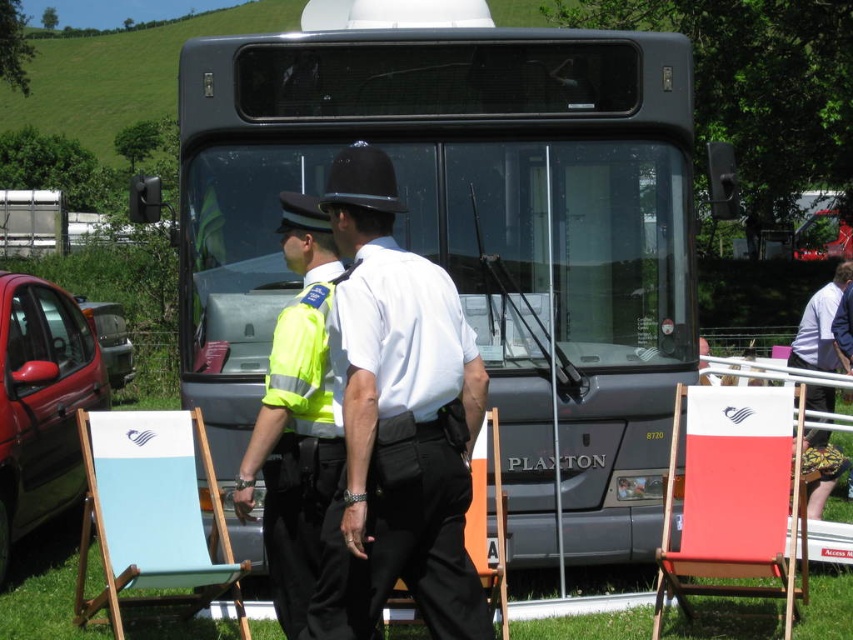
Question: Which is farther from the yellow reflective vest at center?

Choices:
 (A) high-visibility fabric safety vest at center
 (B) white glossy shirt at center
 (C) metallic gray bus at center
 (D) white shirt at right

Answer: (D)

Question: Is yellow reflective vest at center thinner than high-visibility fabric safety vest at center?

Choices:
 (A) yes
 (B) no

Answer: (B)

Question: Can you confirm if metallic gray bus at center is positioned below white shirt at right?

Choices:
 (A) yes
 (B) no

Answer: (B)

Question: Which object appears closest to the camera in this image?

Choices:
 (A) white glossy shirt at center
 (B) high-visibility fabric safety vest at center
 (C) white shirt at right

Answer: (A)

Question: Can you confirm if yellow reflective vest at center is thinner than white shirt at right?

Choices:
 (A) yes
 (B) no

Answer: (A)

Question: Considering the real-world distances, which object is closest to the white glossy shirt at center?

Choices:
 (A) metallic gray bus at center
 (B) white shirt at right
 (C) yellow reflective vest at center
 (D) high-visibility fabric safety vest at center

Answer: (C)